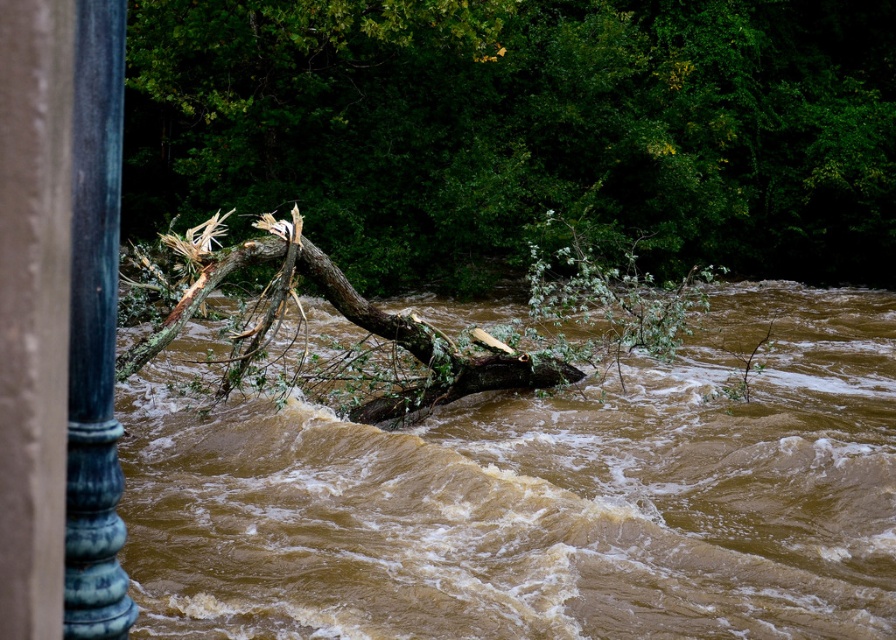
Question: Is brown wood tree at center wider than blue polished metal pole at left?

Choices:
 (A) no
 (B) yes

Answer: (B)

Question: Which of the following is the farthest from the observer?

Choices:
 (A) (768, 6)
 (B) (838, 400)

Answer: (A)

Question: Which point appears farthest from the camera in this image?

Choices:
 (A) (419, 51)
 (B) (85, 392)

Answer: (A)

Question: Is brown muddy water at center smaller than brown wood tree at center?

Choices:
 (A) no
 (B) yes

Answer: (B)

Question: Is brown muddy water at center wider than blue polished metal pole at left?

Choices:
 (A) yes
 (B) no

Answer: (A)

Question: Which object is closer to the camera taking this photo?

Choices:
 (A) blue polished metal pole at left
 (B) brown wood tree at center
 (C) brown muddy water at center

Answer: (A)